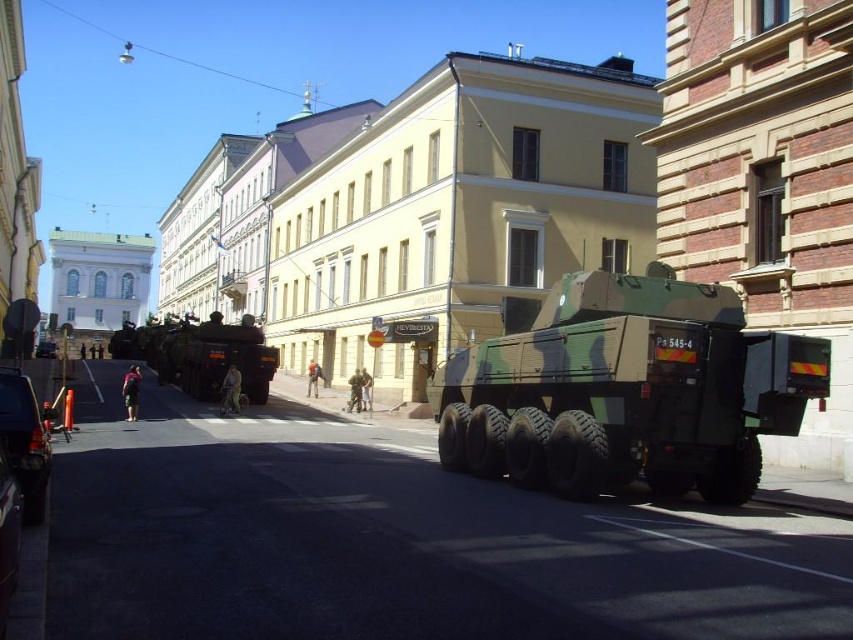
Does camouflage fabric tank at center appear over metallic blue truck at lower left?

Correct, camouflage fabric tank at center is located above metallic blue truck at lower left.

Does point (577, 362) come closer to viewer compared to point (39, 417)?

No, it is not.

Identify the location of camouflage fabric tank at center. (627, 390).

Who is taller, camouflage fabric tank at center or matte black tank at left?

With more height is matte black tank at left.

Consider the image. Who is positioned more to the right, camouflage fabric tank at center or matte black tank at left?

camouflage fabric tank at center

Is point (726, 483) more distant than point (265, 353)?

No, (726, 483) is in front of (265, 353).

Find the location of a particular element. camouflage fabric tank at center is located at coordinates (627, 390).

Between metallic blue truck at lower left and camouflage fabric military truck at center, which one is positioned lower?

camouflage fabric military truck at center is below.

In the scene shown: How much distance is there between metallic blue truck at lower left and camouflage fabric military truck at center?

They are 72.49 meters apart.

Image resolution: width=853 pixels, height=640 pixels. What do you see at coordinates (25, 442) in the screenshot?
I see `metallic blue truck at lower left` at bounding box center [25, 442].

What are the coordinates of `metallic blue truck at lower left` in the screenshot? It's located at (25, 442).